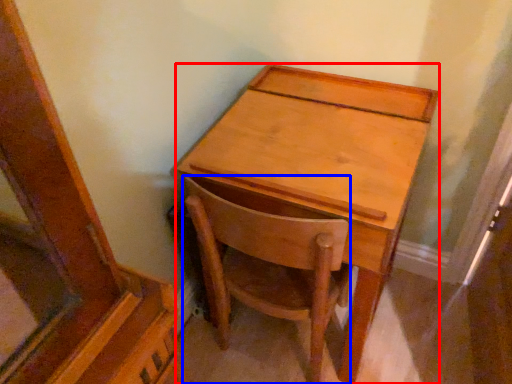
Question: Which object is closer to the camera taking this photo, desk (highlighted by a red box) or chair (highlighted by a blue box)?

Choices:
 (A) desk
 (B) chair

Answer: (A)